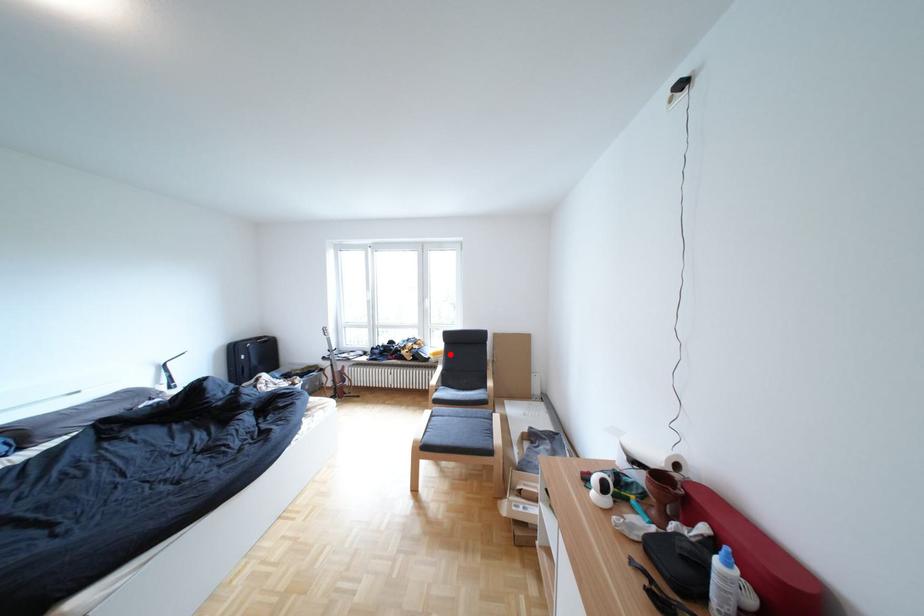
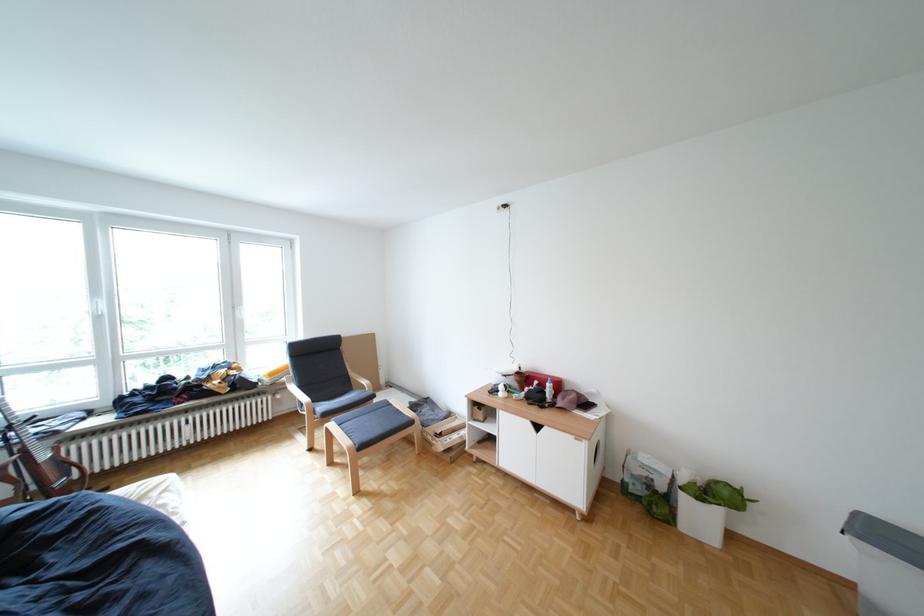
Find the pixel in the second image that matches the highlighted location in the first image.

(286, 374)